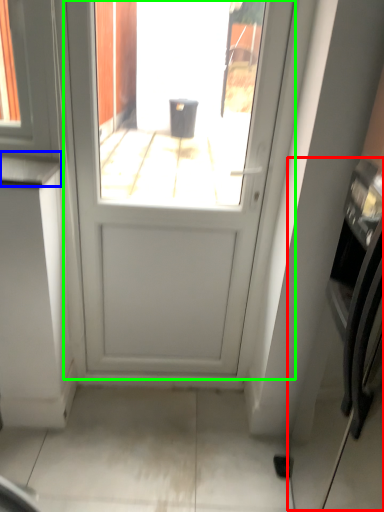
Question: Estimate the real-world distances between objects in this image. Which object is farther from oven (highlighted by a red box), counter top (highlighted by a blue box) or door (highlighted by a green box)?

Choices:
 (A) counter top
 (B) door

Answer: (A)